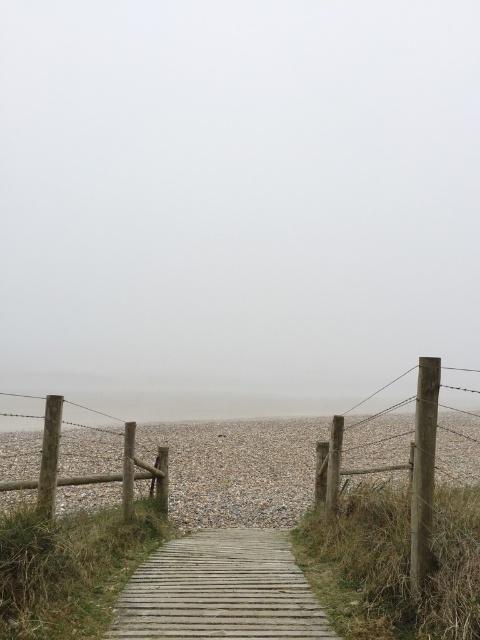
Question: Which object is closer to the camera taking this photo?

Choices:
 (A) wooden planks at center
 (B) wooden fence at right
 (C) gray gravel at center
 (D) brown wooden fence at left

Answer: (A)

Question: Observing the image, what is the correct spatial positioning of wooden fence at right in reference to brown wooden fence at left?

Choices:
 (A) left
 (B) right

Answer: (B)

Question: Which point is farther from the camera taking this photo?

Choices:
 (A) (208, 545)
 (B) (292, 524)
 (C) (55, 440)

Answer: (B)

Question: Is gray gravel at center thinner than wooden fence at right?

Choices:
 (A) no
 (B) yes

Answer: (A)

Question: Does wooden planks at center appear under brown wooden fence at left?

Choices:
 (A) yes
 (B) no

Answer: (A)

Question: Which object is farther from the camera taking this photo?

Choices:
 (A) gray gravel at center
 (B) brown wooden fence at left
 (C) wooden planks at center

Answer: (A)